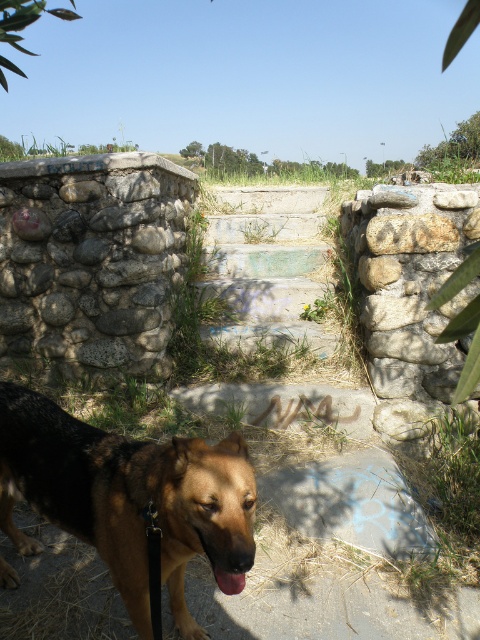
Is brown matte dog at lower left closer to the viewer compared to gray rough stone at center?

Yes, it is in front of gray rough stone at center.

Who is more forward, (2,472) or (432,230)?

Point (2,472)

Is point (145, 536) positioned in front of point (381, 264)?

Yes.

Where is `brown matte dog at lower left`? This screenshot has width=480, height=640. brown matte dog at lower left is located at coordinates (127, 497).

Does brown matte dog at lower left have a greater height compared to brown matte dog mouth at lower center?

Indeed, brown matte dog at lower left has a greater height compared to brown matte dog mouth at lower center.

This screenshot has width=480, height=640. What do you see at coordinates (127, 497) in the screenshot? I see `brown matte dog at lower left` at bounding box center [127, 497].

Identify the location of brown matte dog at lower left. (127, 497).

Describe the element at coordinates (92, 259) in the screenshot. The image size is (480, 640). I see `natural stone wall at upper left` at that location.

In the scene shown: Does natural stone wall at upper left have a lesser width compared to brown matte dog at lower left?

Incorrect, natural stone wall at upper left's width is not less than brown matte dog at lower left's.

Which is behind, point (110, 186) or point (48, 484)?

Positioned behind is point (110, 186).

What are the coordinates of `natural stone wall at upper left` in the screenshot? It's located at (92, 259).